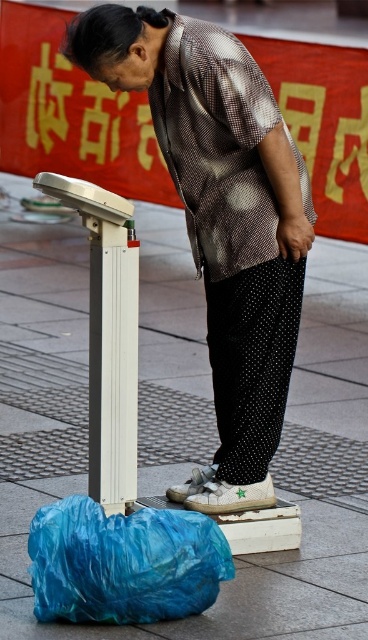
Between point (309, 532) and point (101, 388), which one is positioned behind?

Positioned behind is point (309, 532).

Is point (359, 452) in front of point (100, 445)?

No, it is not.

Locate an element on the screen. The width and height of the screenshot is (368, 640). white tile pavement at center is located at coordinates (274, 458).

Is white plastic scale at lower left above white metallic scale at lower left?

Yes, white plastic scale at lower left is above white metallic scale at lower left.

Does white plastic scale at lower left have a smaller size compared to white metallic scale at lower left?

Incorrect, white plastic scale at lower left is not smaller in size than white metallic scale at lower left.

This screenshot has height=640, width=368. What are the coordinates of `white plastic scale at lower left` in the screenshot? It's located at (107, 337).

This screenshot has height=640, width=368. What are the coordinates of `white plastic scale at lower left` in the screenshot? It's located at (107, 337).

In the scene shown: Can you confirm if metallic patterned shirt at center is shorter than white plastic scale at lower left?

No.

Can you confirm if metallic patterned shirt at center is smaller than white plastic scale at lower left?

No, metallic patterned shirt at center is not smaller than white plastic scale at lower left.

Which is behind, point (79, 58) or point (121, 298)?

Positioned behind is point (121, 298).

Locate an element on the screen. metallic patterned shirt at center is located at coordinates (221, 220).